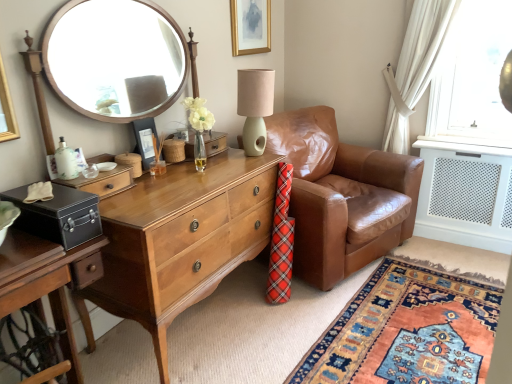
In order to click on vacant space in between light brown wood desk at center and brown leather armchair at center in this screenshot , I will do `click(263, 330)`.